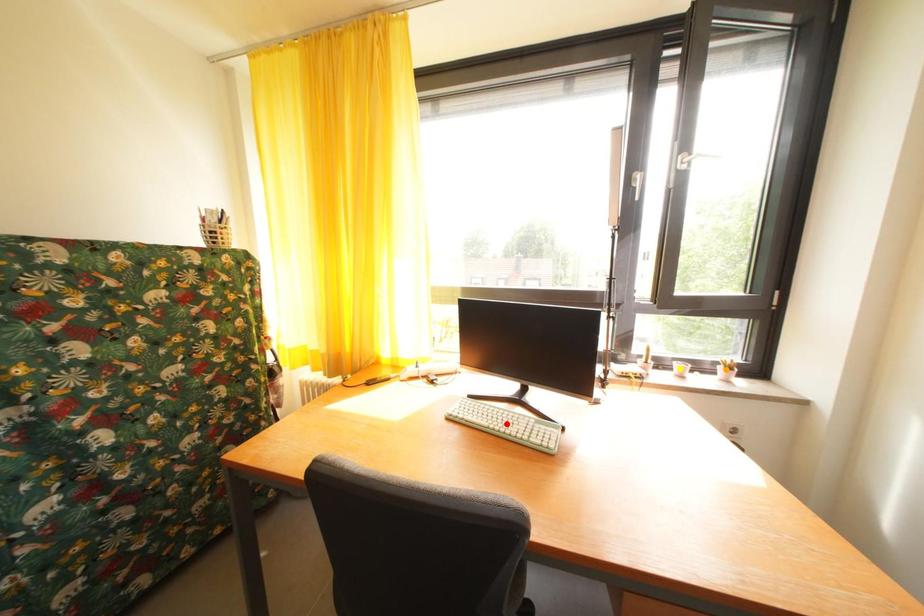
In the scene shown: Order these from nearest to farthest:
red point, orange point, yellow point

red point < orange point < yellow point